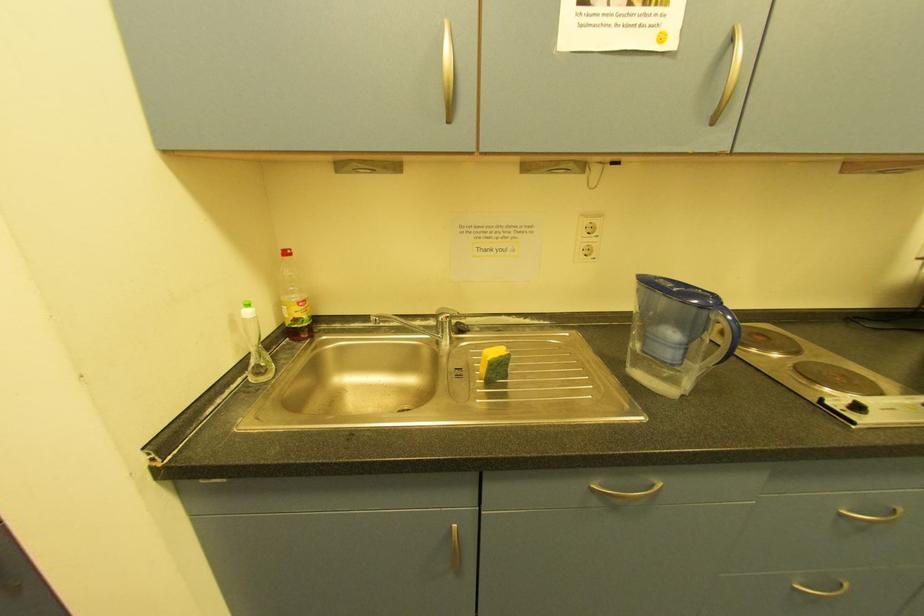
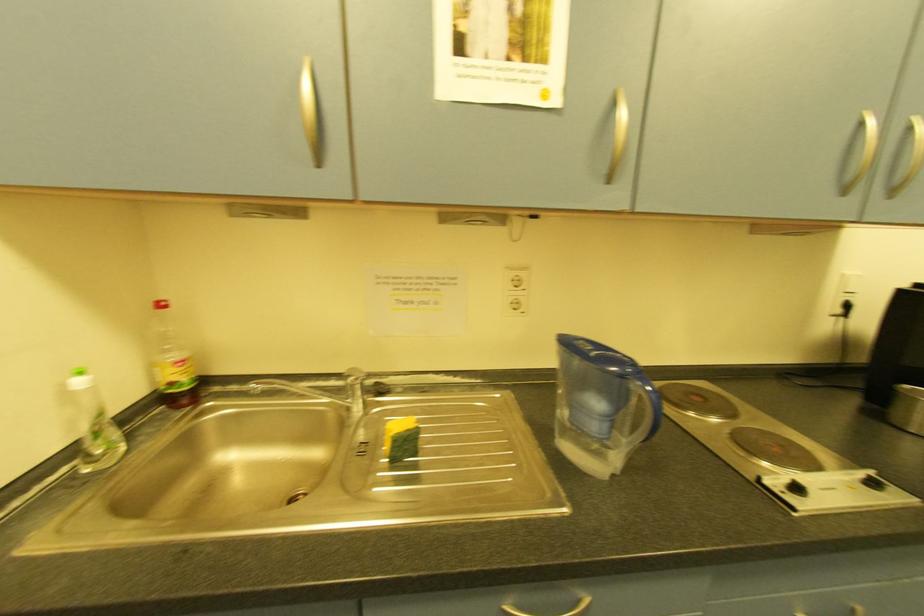
What movement of the cameraman would produce the second image?

The movement direction of the cameraman is right, forward.